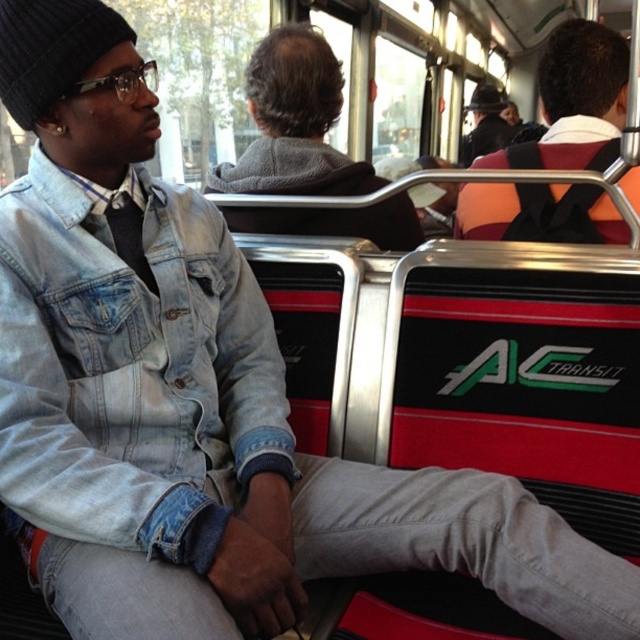
Who is positioned more to the right, orange fabric backpack at upper right or black knit hat at upper center?

black knit hat at upper center is more to the right.

Who is higher up, orange fabric backpack at upper right or black knit hat at upper center?

Positioned higher is black knit hat at upper center.

Is point (504, 152) in front of point (490, 108)?

That is True.

Where is `orange fabric backpack at upper right`? This screenshot has height=640, width=640. orange fabric backpack at upper right is located at coordinates (580, 92).

Is the position of black knit beanie at upper left more distant than that of black knit hat at upper center?

No.

Is black knit beanie at upper left smaller than black knit hat at upper center?

Yes.

Who is more distant from viewer, [60,48] or [481,99]?

Positioned behind is point [481,99].

You are a GUI agent. You are given a task and a screenshot of the screen. Output one action in this format:
    pyautogui.click(x=<x>, y=<y>)
    Task: Click on the black knit beanie at upper left
    Image resolution: width=640 pixels, height=640 pixels.
    Given the screenshot: What is the action you would take?
    pyautogui.click(x=51, y=51)

This screenshot has height=640, width=640. Identify the location of black knit beanie at upper left. (51, 51).

Between black knit beanie at upper left and matte black hat at upper center, which one appears on the right side from the viewer's perspective?

Positioned to the right is matte black hat at upper center.

This screenshot has width=640, height=640. Identify the location of black knit beanie at upper left. (51, 51).